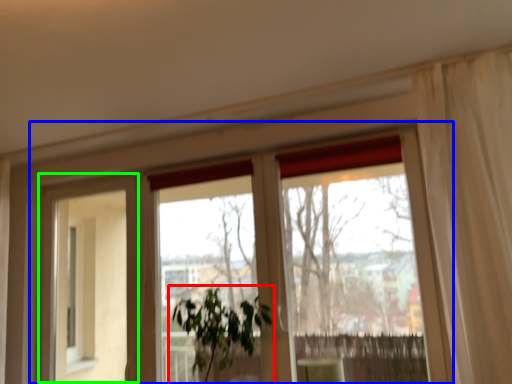
Question: Which is farther away from houseplant (highlighted by a red box)? window (highlighted by a blue box) or screen door (highlighted by a green box)?

Choices:
 (A) window
 (B) screen door

Answer: (B)